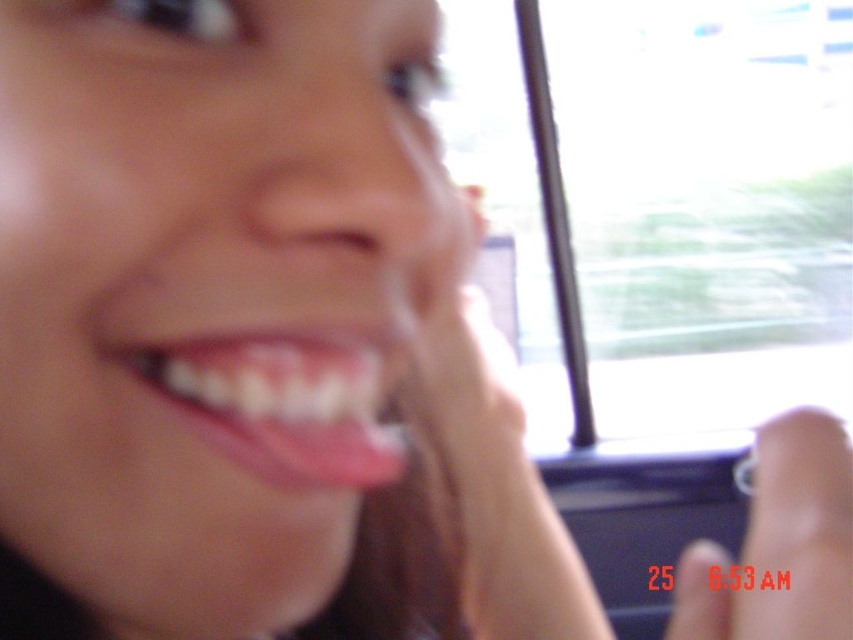
Describe the element at coordinates (247, 323) in the screenshot. This screenshot has width=853, height=640. I see `smooth skin face at center` at that location.

Between point (219, 573) and point (368, 458), which one is positioned in front?

Point (219, 573)

This screenshot has width=853, height=640. Identify the location of smooth skin face at center. (247, 323).

Does white glossy teeth at center appear under clear plastic finger at center?

Actually, white glossy teeth at center is above clear plastic finger at center.

Does white glossy teeth at center have a greater height compared to clear plastic finger at center?

In fact, white glossy teeth at center may be shorter than clear plastic finger at center.

Does point (200, 362) lie in front of point (799, 444)?

That is True.

This screenshot has height=640, width=853. Find the location of `white glossy teeth at center`. white glossy teeth at center is located at coordinates pyautogui.click(x=277, y=403).

Can you confirm if smooth skin face at center is taller than clear plastic finger at center?

Yes.

Which is behind, point (579, 577) or point (779, 472)?

The point (579, 577) is more distant.

The image size is (853, 640). I want to click on smooth skin face at center, so click(x=247, y=323).